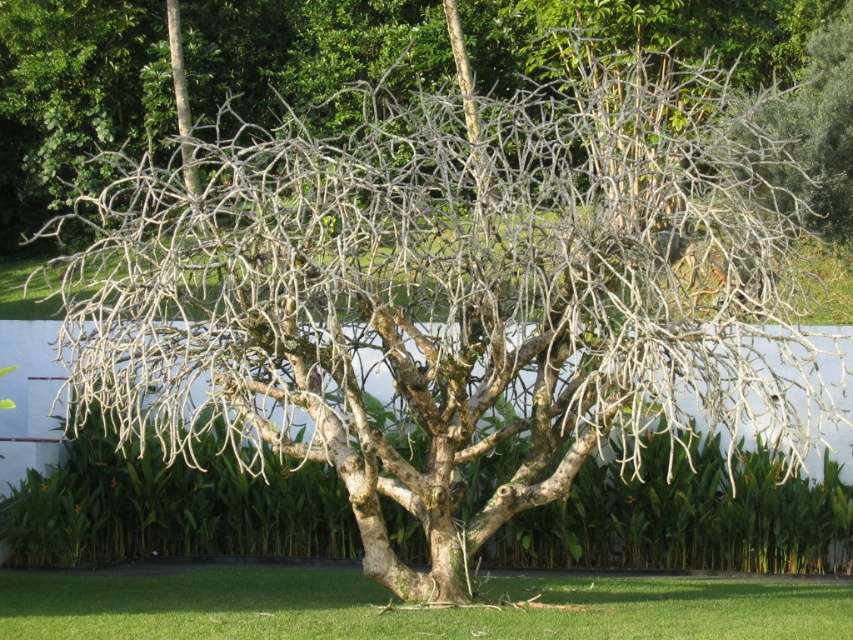
Question: Is bare branches at center positioned behind green grass at lower center?

Choices:
 (A) yes
 (B) no

Answer: (A)

Question: Which point is closer to the camera?

Choices:
 (A) green grass at lower center
 (B) bare branches at center

Answer: (A)

Question: Is bare branches at center wider than green grass at lower center?

Choices:
 (A) no
 (B) yes

Answer: (B)

Question: Which point appears farthest from the camera in this image?

Choices:
 (A) (189, 632)
 (B) (744, 81)

Answer: (B)

Question: Is bare branches at center below green grass at lower center?

Choices:
 (A) no
 (B) yes

Answer: (A)